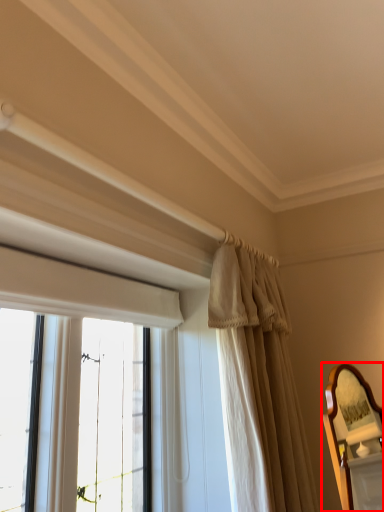
Question: Observing the image, what is the correct spatial positioning of mirror (annotated by the red box) in reference to curtain?

Choices:
 (A) left
 (B) right

Answer: (B)